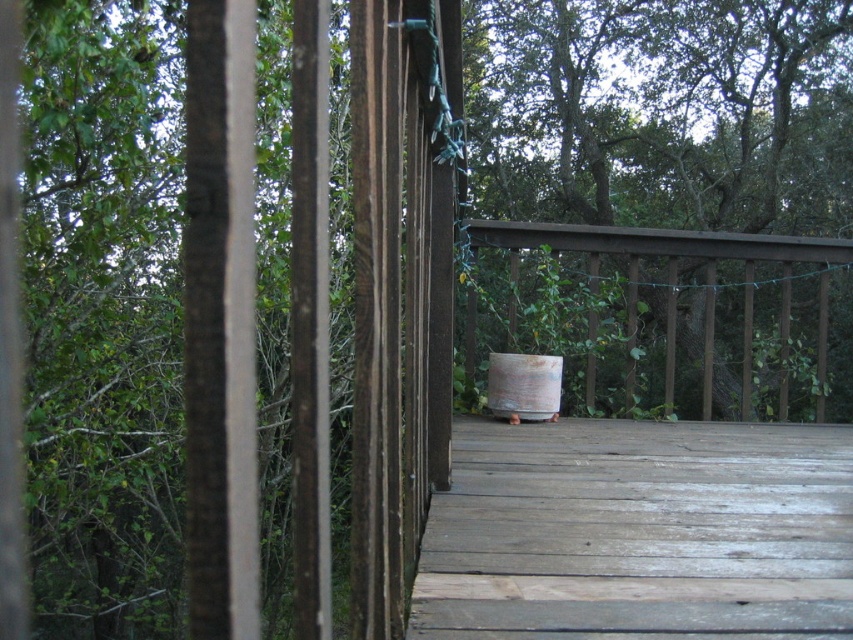
Question: Is weathered wood deck at center smaller than brown wooden rail at center?

Choices:
 (A) yes
 (B) no

Answer: (A)

Question: Estimate the real-world distances between objects in this image. Which object is closer to the brown wooden rail at center?

Choices:
 (A) weathered wood deck at center
 (B) rusty metal barrel at center
 (C) white ceramic pot at center

Answer: (B)

Question: Can you confirm if white ceramic pot at center is bigger than rusty metal barrel at center?

Choices:
 (A) yes
 (B) no

Answer: (A)

Question: Does weathered wood deck at center appear over rusty metal barrel at center?

Choices:
 (A) no
 (B) yes

Answer: (A)

Question: Which object is farther from the camera taking this photo?

Choices:
 (A) white ceramic pot at center
 (B) brown wooden rail at center
 (C) rusty metal barrel at center
 (D) weathered wood deck at center

Answer: (A)

Question: Estimate the real-world distances between objects in this image. Which object is farther from the brown wooden rail at center?

Choices:
 (A) white ceramic pot at center
 (B) weathered wood deck at center
 (C) rusty metal barrel at center

Answer: (A)